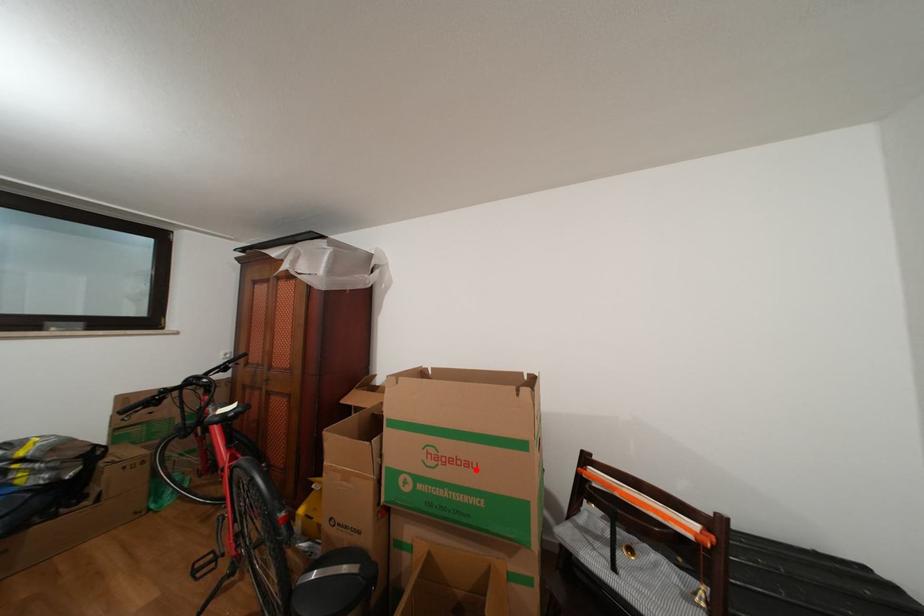
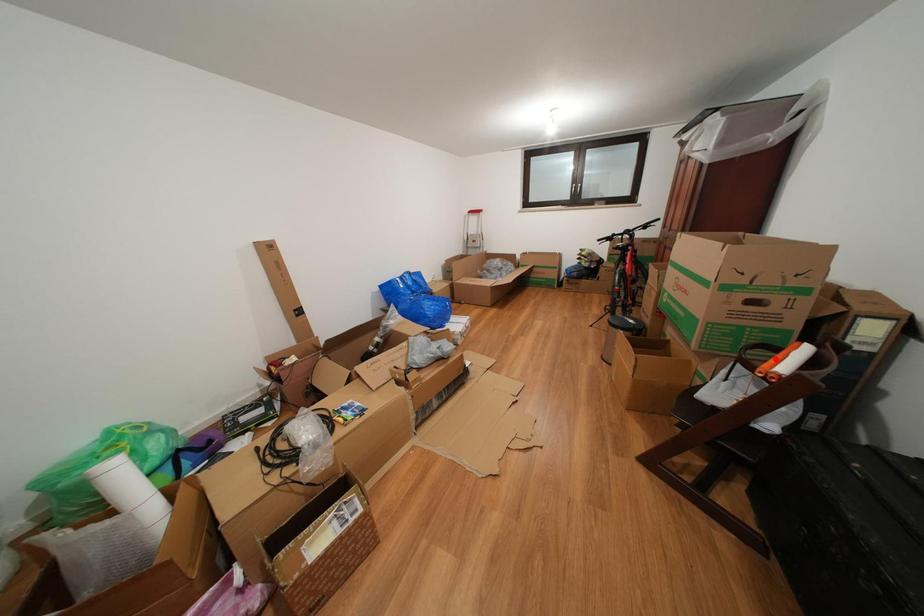
I am providing you with two images of the same scene from different viewpoints. A red point is marked on the first image and another point is marked on the second image. Does the point marked in image1 correspond to the same location as the one in image2?

No